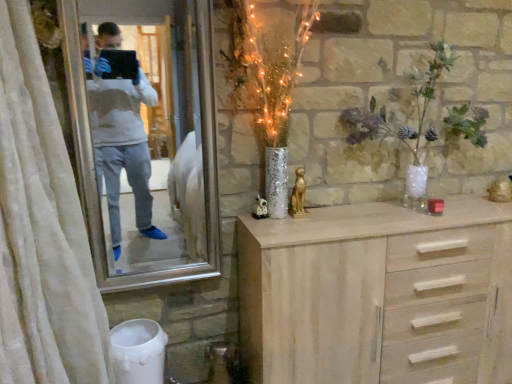
Question: From a real-world perspective, is light wood chest of drawers at center on translucent glass vase at upper right?

Choices:
 (A) yes
 (B) no

Answer: (B)

Question: Can you confirm if light wood chest of drawers at center is bigger than translucent glass vase at upper right?

Choices:
 (A) yes
 (B) no

Answer: (A)

Question: Considering the relative sizes of light wood chest of drawers at center and translucent glass vase at upper right in the image provided, is light wood chest of drawers at center wider than translucent glass vase at upper right?

Choices:
 (A) yes
 (B) no

Answer: (A)

Question: Can you confirm if light wood chest of drawers at center is positioned to the left of translucent glass vase at upper right?

Choices:
 (A) yes
 (B) no

Answer: (A)

Question: Could you tell me if light wood chest of drawers at center is facing translucent glass vase at upper right?

Choices:
 (A) no
 (B) yes

Answer: (A)

Question: Is light wood chest of drawers at center directly adjacent to translucent glass vase at upper right?

Choices:
 (A) no
 (B) yes

Answer: (A)

Question: Does light wood chest of drawers at center contain white textured curtain at left?

Choices:
 (A) no
 (B) yes

Answer: (A)

Question: Could you tell me if light wood chest of drawers at center is facing white textured curtain at left?

Choices:
 (A) yes
 (B) no

Answer: (B)

Question: Does light wood chest of drawers at center have a larger size compared to white textured curtain at left?

Choices:
 (A) yes
 (B) no

Answer: (B)

Question: Is light wood chest of drawers at center turned away from white textured curtain at left?

Choices:
 (A) yes
 (B) no

Answer: (B)

Question: Considering the relative sizes of light wood chest of drawers at center and white textured curtain at left in the image provided, is light wood chest of drawers at center smaller than white textured curtain at left?

Choices:
 (A) no
 (B) yes

Answer: (B)

Question: Is light wood chest of drawers at center beside white textured curtain at left?

Choices:
 (A) no
 (B) yes

Answer: (A)

Question: Does silver metallic mirror at upper left have a lesser height compared to light wood chest of drawers at center?

Choices:
 (A) no
 (B) yes

Answer: (A)